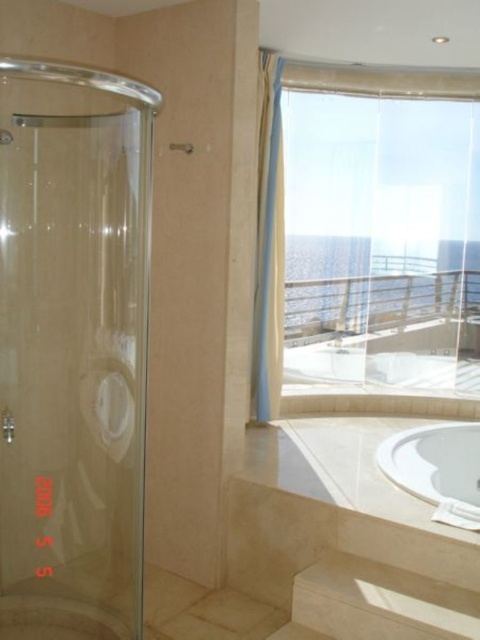
Question: Considering the real-world distances, which object is farthest from the white glossy bathtub at lower right?

Choices:
 (A) beige fabric curtain at upper center
 (B) translucent fabric curtain at upper right

Answer: (B)

Question: Considering the real-world distances, which object is farthest from the translucent fabric curtain at upper right?

Choices:
 (A) white glossy bathtub at lower right
 (B) beige fabric curtain at upper center

Answer: (A)

Question: Observing the image, what is the correct spatial positioning of translucent fabric curtain at upper right in reference to beige fabric curtain at upper center?

Choices:
 (A) left
 (B) right

Answer: (B)

Question: Estimate the real-world distances between objects in this image. Which object is farther from the transparent glass shower at left?

Choices:
 (A) translucent fabric curtain at upper right
 (B) white glossy bathtub at lower right

Answer: (A)

Question: Can you confirm if translucent fabric curtain at upper right is wider than white glossy bathtub at lower right?

Choices:
 (A) yes
 (B) no

Answer: (A)

Question: Does translucent fabric curtain at upper right have a larger size compared to white glossy bathtub at lower right?

Choices:
 (A) yes
 (B) no

Answer: (A)